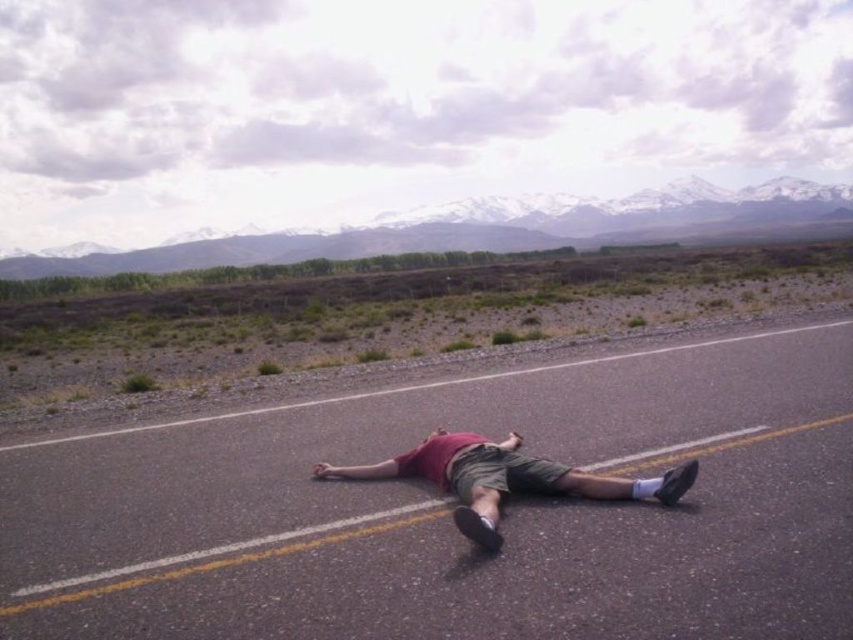
You are a delivery drone flying over the black asphalt highway at center. You need to land precisely at the coordinates provided in the Objects Description. Can you confirm the exact coordinates where you should land?

The black asphalt highway at center is located at point (447, 513), so you should land there.

You are a pedestrian trying to cross the road. You see the black asphalt highway at center and the matte red shirt at center. Which one takes up more space in the image?

The black asphalt highway at center has a larger size compared to the matte red shirt at center, so it takes up more space in the image.